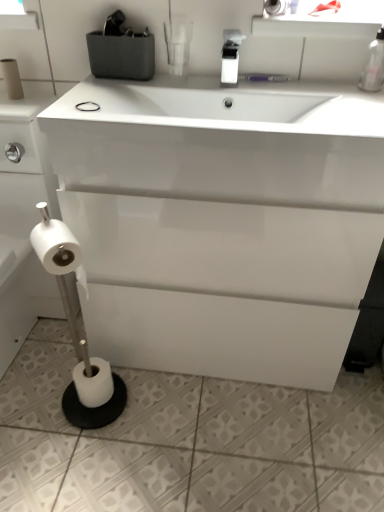
I want to click on free location to the left of transparent glass spray bottle at upper right, the 1th bottle in the right-to-left sequence, so click(x=319, y=89).